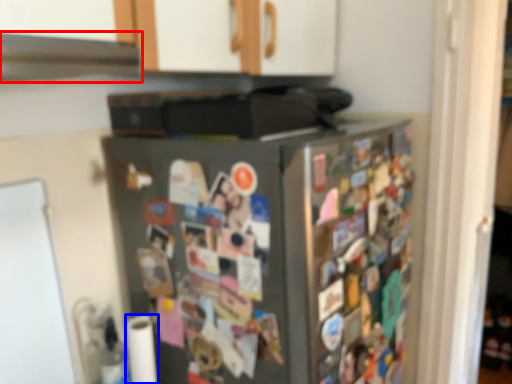
Question: Which object appears closest to the camera in this image, exhaust hood (highlighted by a red box) or toilet paper (highlighted by a blue box)?

Choices:
 (A) exhaust hood
 (B) toilet paper

Answer: (A)